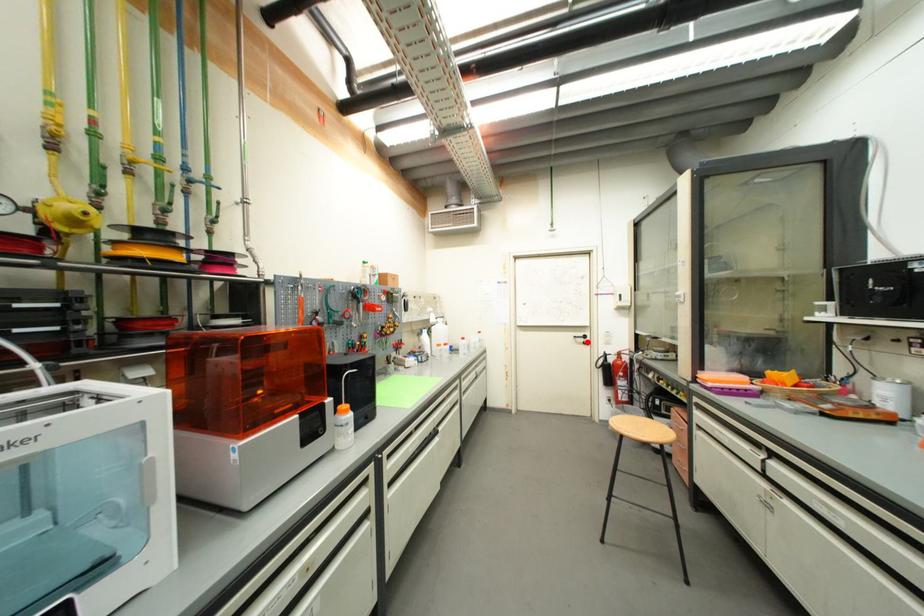
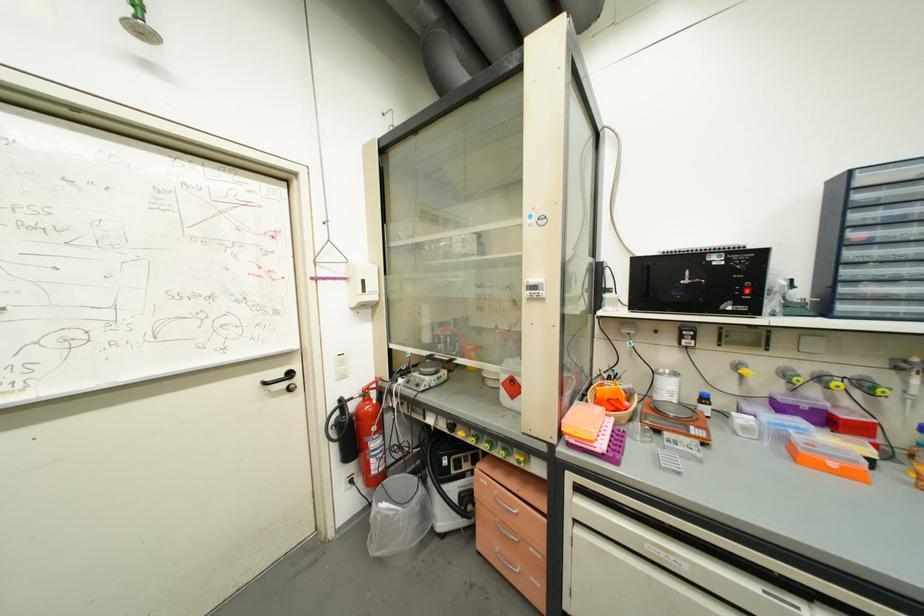
The point at the highlighted location is marked in the first image. Where is the corresponding point in the second image?

(289, 387)